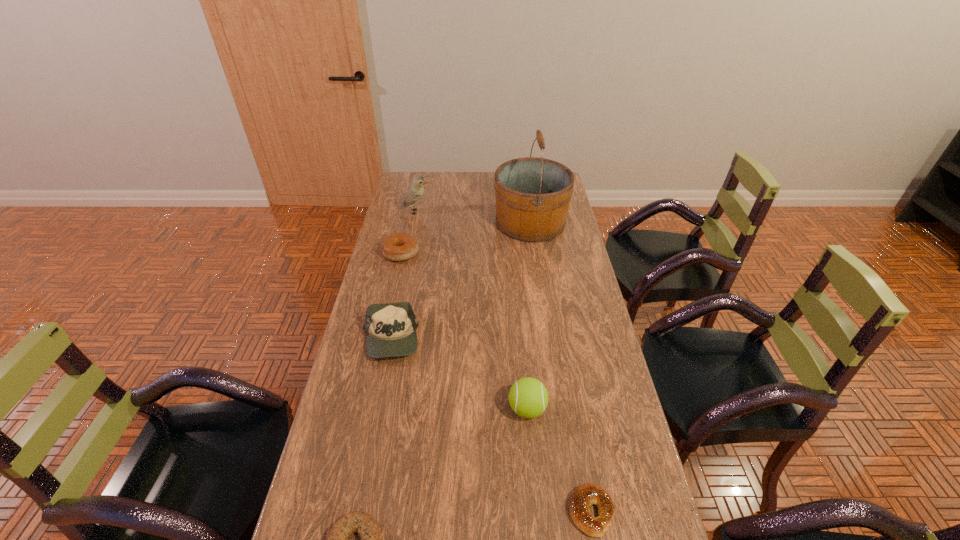
Locate an element on the screen. The width and height of the screenshot is (960, 540). object that is the closest to the third tallest object is located at coordinates (588, 494).

Identify the location of the closest object relative to the fourth tallest object. (397, 247).

Identify which bagel is the third closest to the second tallest object. Please provide its 2D coordinates. Your answer should be formatted as a tuple, i.e. [(x, y)], where the tuple contains the x and y coordinates of a point satisfying the conditions above.

[(588, 494)]

Where is `the second closest bagel relative to the tallest bagel`? the second closest bagel relative to the tallest bagel is located at coordinates (588, 494).

Locate an element on the screen. Image resolution: width=960 pixels, height=540 pixels. vacant area in the image that satisfies the following two spatial constraints: 1. at the face of the rightmost bagel; 2. on the right side of the bird is located at coordinates (355, 511).

Where is `free space that satisfies the following two spatial constraints: 1. on the front side of the tallest bagel; 2. on the left side of the rightmost bagel`? free space that satisfies the following two spatial constraints: 1. on the front side of the tallest bagel; 2. on the left side of the rightmost bagel is located at coordinates (346, 511).

Find the location of a particular element. The width and height of the screenshot is (960, 540). free space that satisfies the following two spatial constraints: 1. on the front-facing side of the tennis ball; 2. on the left side of the baseball cap is located at coordinates 376,409.

The width and height of the screenshot is (960, 540). Identify the location of vacant point that satisfies the following two spatial constraints: 1. on the back side of the fifth shortest object; 2. on the right side of the bucket. (510, 222).

The width and height of the screenshot is (960, 540). I want to click on vacant space that satisfies the following two spatial constraints: 1. on the back side of the tallest object; 2. at the face of the second tallest object, so click(x=529, y=212).